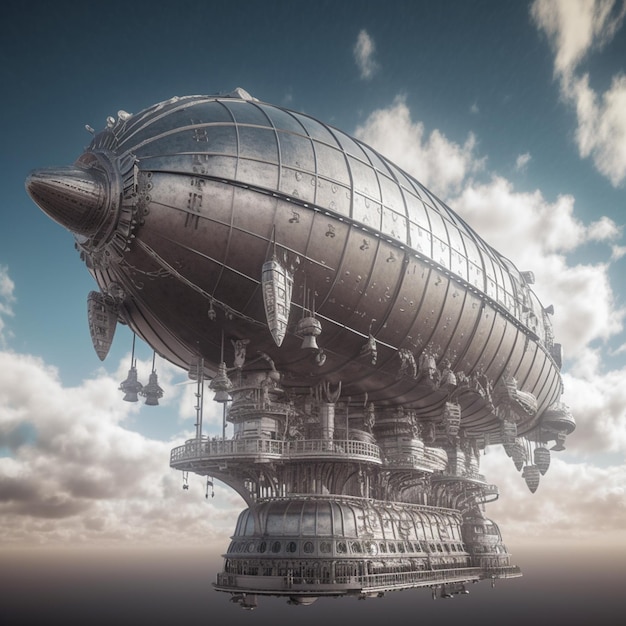
Locate an element on the screen. Image resolution: width=626 pixels, height=626 pixels. pillars is located at coordinates (198, 366), (223, 424).